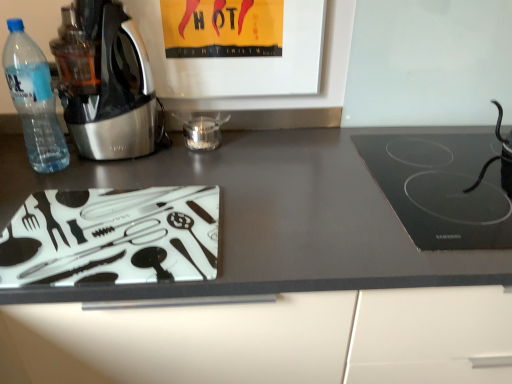
This screenshot has height=384, width=512. What do you see at coordinates (442, 188) in the screenshot? I see `black glass cooktop at right` at bounding box center [442, 188].

Measure the distance between transparent glass jar at center, which is the 2th appliance in right-to-left order, and camera.

transparent glass jar at center, which is the 2th appliance in right-to-left order, and camera are 1.08 meters apart from each other.

Describe the element at coordinates (106, 83) in the screenshot. The width and height of the screenshot is (512, 384). I see `metallic stainless steel kettle at left` at that location.

Where is `black glass cooktop at right`? The width and height of the screenshot is (512, 384). black glass cooktop at right is located at coordinates (442, 188).

Is black rubber cable at right, which ranks as the first appliance in right-to-left order, at the right side of black glass cooktop at right?

Yes.

Who is taller, black rubber cable at right, which ranks as the first appliance in right-to-left order, or black glass cooktop at right?

black rubber cable at right, which ranks as the first appliance in right-to-left order, is taller.

From a real-world perspective, is black rubber cable at right, which is counted as the 2th appliance, starting from the left, below black glass cooktop at right?

No.

Are black rubber cable at right, which is counted as the 2th appliance, starting from the left, and black glass cooktop at right far apart?

No, black rubber cable at right, which is counted as the 2th appliance, starting from the left, is in close proximity to black glass cooktop at right.

Does point (147, 94) come closer to viewer compared to point (50, 168)?

No.

From a real-world perspective, is metallic stainless steel kettle at left positioned above or below transparent plastic bottle at left?

Clearly, from a real-world perspective, metallic stainless steel kettle at left is above transparent plastic bottle at left.

Looking at this image, would you consider metallic stainless steel kettle at left to be distant from transparent plastic bottle at left?

That's not correct — metallic stainless steel kettle at left is a little close to transparent plastic bottle at left.

The image size is (512, 384). Find the location of `bottle lying below the metallic stainless steel kettle at left (from the image's perspective)`. bottle lying below the metallic stainless steel kettle at left (from the image's perspective) is located at coordinates (34, 100).

From a real-world perspective, between black rubber cable at right, which ranks as the first appliance in right-to-left order, and transparent glass jar at center, arranged as the first appliance when viewed from the left, who is vertically higher?

black rubber cable at right, which ranks as the first appliance in right-to-left order.

In order to click on appliance on the left side of black rubber cable at right, which is counted as the 2th appliance, starting from the left in this screenshot , I will do `click(202, 131)`.

How many degrees apart are the facing directions of black rubber cable at right, which ranks as the first appliance in right-to-left order, and transparent glass jar at center, which is the 2th appliance in right-to-left order?

There is a 1.77-degree angle between the facing directions of black rubber cable at right, which ranks as the first appliance in right-to-left order, and transparent glass jar at center, which is the 2th appliance in right-to-left order.

Relative to transparent glass jar at center, arranged as the first appliance when viewed from the left, is black rubber cable at right, which is counted as the 2th appliance, starting from the left, in front or behind?

Visually, black rubber cable at right, which is counted as the 2th appliance, starting from the left, is located in front of transparent glass jar at center, arranged as the first appliance when viewed from the left.

In the scene shown: Would you say transparent plastic bottle at left is a long distance from metallic stainless steel kettle at left?

No, transparent plastic bottle at left is not far from metallic stainless steel kettle at left.

Is point (42, 82) positioned in front of point (110, 87)?

Yes, it is in front of point (110, 87).

How different are the orientations of transparent plastic bottle at left and metallic stainless steel kettle at left in degrees?

They differ by 0.00407 degrees in their facing directions.

In the image, there is a metallic stainless steel kettle at left. In order to click on bottle below it (from a real-world perspective) in this screenshot , I will do [x=34, y=100].

Is metallic stainless steel kettle at left inside transparent glass jar at center, arranged as the first appliance when viewed from the left?

No.

What's the angular difference between transparent glass jar at center, which is the 2th appliance in right-to-left order, and metallic stainless steel kettle at left's facing directions?

They differ by 0.00297 degrees in their facing directions.

Can you see transparent glass jar at center, arranged as the first appliance when viewed from the left, touching metallic stainless steel kettle at left?

They are not placed beside each other.

From the image's perspective, which one is positioned higher, transparent glass jar at center, which is the 2th appliance in right-to-left order, or metallic stainless steel kettle at left?

From the image's view, metallic stainless steel kettle at left is above.

Considering the relative positions of transparent plastic bottle at left and black glass cooktop at right in the image provided, is transparent plastic bottle at left to the left or to the right of black glass cooktop at right?

In the image, transparent plastic bottle at left appears on the left side of black glass cooktop at right.

From a real-world perspective, which is physically below, transparent plastic bottle at left or black glass cooktop at right?

black glass cooktop at right.

Looking at this image, is transparent plastic bottle at left further to the viewer compared to black glass cooktop at right?

Yes.

Does transparent plastic bottle at left turn towards black glass cooktop at right?

No, transparent plastic bottle at left is not aimed at black glass cooktop at right.

Based on the photo, choose the correct answer: Is black glass cooktop at right inside transparent glass jar at center, which is the 2th appliance in right-to-left order, or outside it?

black glass cooktop at right is spatially situated outside transparent glass jar at center, which is the 2th appliance in right-to-left order.

From the picture: Is black glass cooktop at right facing towards transparent glass jar at center, which is the 2th appliance in right-to-left order?

No, black glass cooktop at right is not turned towards transparent glass jar at center, which is the 2th appliance in right-to-left order.

Who is taller, black glass cooktop at right or transparent glass jar at center, arranged as the first appliance when viewed from the left?

With more height is black glass cooktop at right.

The image size is (512, 384). I want to click on the 1st appliance behind the black glass cooktop at right, so click(499, 157).

In the image, there is a transparent plastic bottle at left. In order to click on home appliance above it (from the image's perspective) in this screenshot , I will do `click(106, 83)`.

Estimate the real-world distances between objects in this image. Which object is closer to black glass cooktop at right, transparent glass jar at center, which is the 2th appliance in right-to-left order, or transparent plastic bottle at left?

transparent glass jar at center, which is the 2th appliance in right-to-left order, is positioned closer to the anchor black glass cooktop at right.

Considering their positions, is metallic stainless steel kettle at left positioned further to black glass cooktop at right than transparent glass jar at center, arranged as the first appliance when viewed from the left?

Based on the image, metallic stainless steel kettle at left appears to be further to black glass cooktop at right.

Which object lies further to the anchor point matte glass cutting board at lower left, black rubber cable at right, which is counted as the 2th appliance, starting from the left, or transparent plastic bottle at left?

The object further to matte glass cutting board at lower left is black rubber cable at right, which is counted as the 2th appliance, starting from the left.

Consider the image. Considering their positions, is metallic stainless steel kettle at left positioned closer to matte glass cutting board at lower left than black glass cooktop at right?

The object closer to matte glass cutting board at lower left is black glass cooktop at right.

Based on their spatial positions, is black glass cooktop at right or metallic stainless steel kettle at left closer to transparent glass jar at center, which is the 2th appliance in right-to-left order?

Based on the image, metallic stainless steel kettle at left appears to be nearer to transparent glass jar at center, which is the 2th appliance in right-to-left order.

From the image, which object appears to be farther from matte glass cutting board at lower left, transparent glass jar at center, which is the 2th appliance in right-to-left order, or transparent plastic bottle at left?

transparent plastic bottle at left lies further to matte glass cutting board at lower left than the other object.

Based on their spatial positions, is black rubber cable at right, which ranks as the first appliance in right-to-left order, or black glass cooktop at right closer to transparent glass jar at center, arranged as the first appliance when viewed from the left?

Based on the image, black glass cooktop at right appears to be nearer to transparent glass jar at center, arranged as the first appliance when viewed from the left.

Considering their positions, is black rubber cable at right, which is counted as the 2th appliance, starting from the left, positioned closer to transparent plastic bottle at left than metallic stainless steel kettle at left?

Among the two, metallic stainless steel kettle at left is located nearer to transparent plastic bottle at left.

Identify the location of countertop between transparent glass jar at center, which is the 2th appliance in right-to-left order, and black glass cooktop at right, in the horizontal direction. (271, 277).

You are a GUI agent. You are given a task and a screenshot of the screen. Output one action in this format:
    pyautogui.click(x=<x>, y=<y>)
    Task: Click on the countertop between transparent plastic bottle at left and black glass cooktop at right in the horizontal direction
    The image size is (512, 384).
    Given the screenshot: What is the action you would take?
    pyautogui.click(x=271, y=277)

The width and height of the screenshot is (512, 384). I want to click on home appliance located between transparent plastic bottle at left and black glass cooktop at right in the left-right direction, so click(106, 83).

Locate an element on the screen. Image resolution: width=512 pixels, height=384 pixels. countertop between metallic stainless steel kettle at left and black glass cooktop at right is located at coordinates (271, 277).